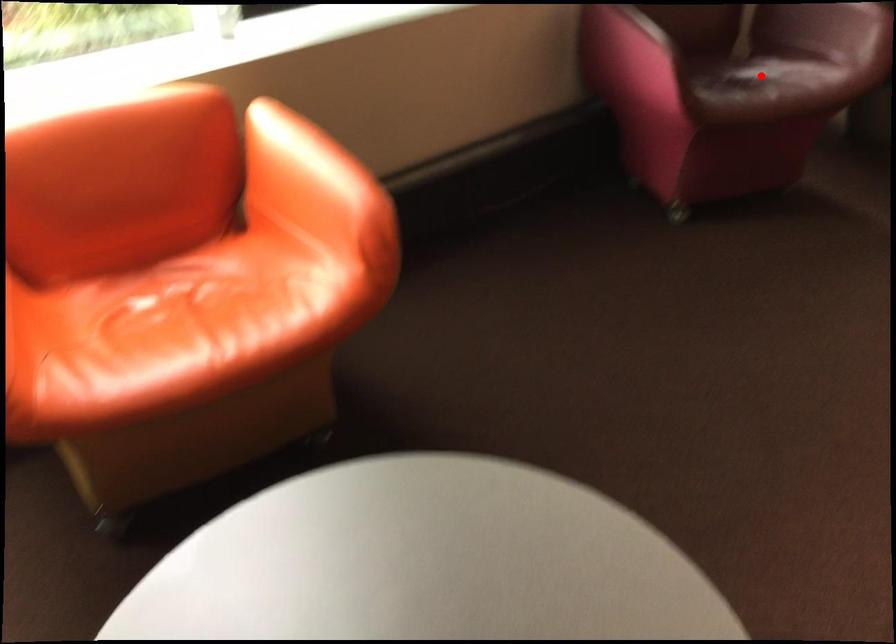
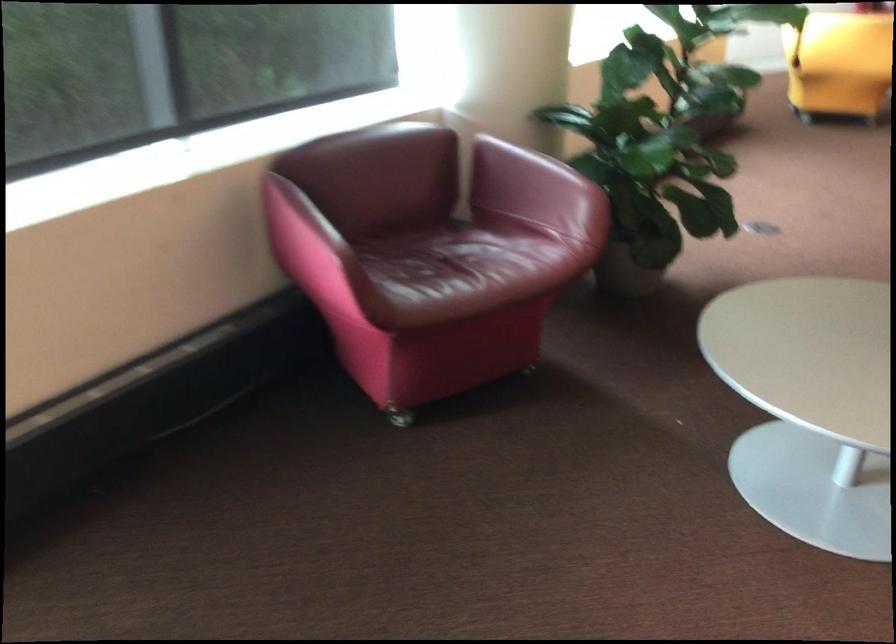
In the second image, find the point that corresponds to the highlighted location in the first image.

(466, 266)